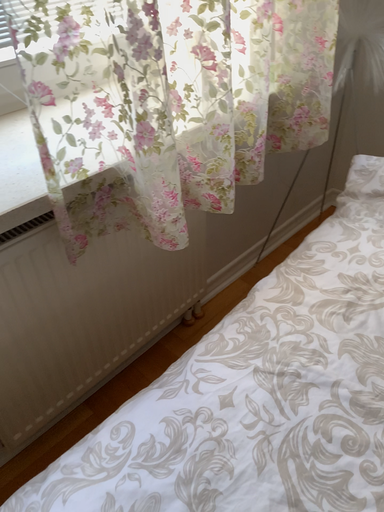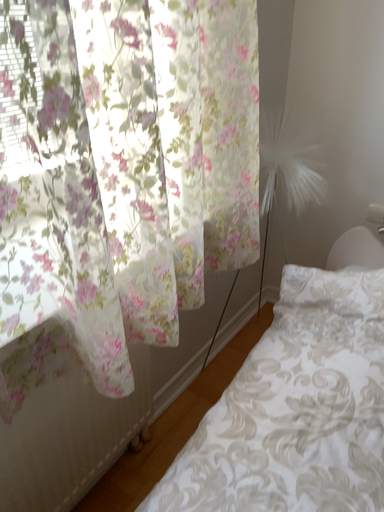
Question: Which way did the camera rotate in the video?

Choices:
 (A) rotated downward
 (B) rotated upward

Answer: (B)